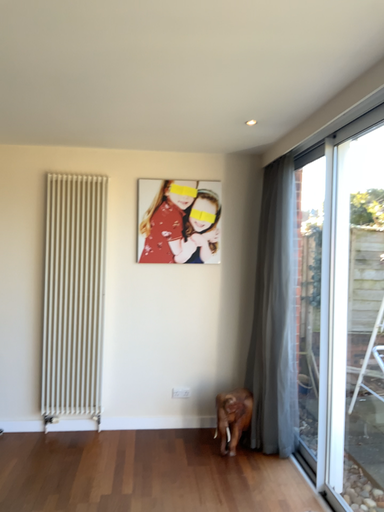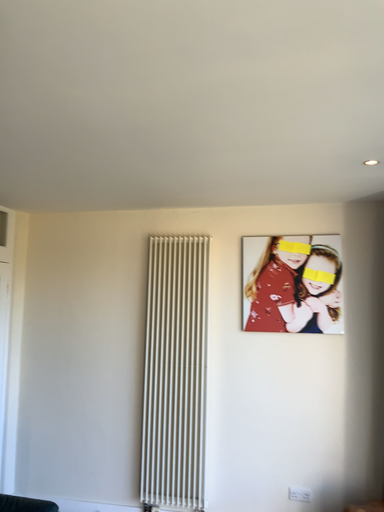
Question: How did the camera likely rotate when shooting the video?

Choices:
 (A) rotated right
 (B) rotated left

Answer: (B)